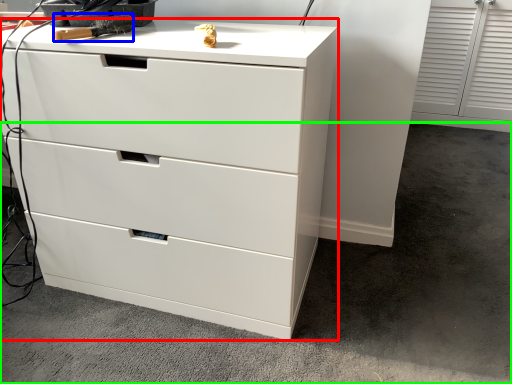
Question: Which is nearer to the chest of drawers (highlighted by a red box)? tool (highlighted by a blue box) or concrete (highlighted by a green box).

Choices:
 (A) tool
 (B) concrete

Answer: (B)